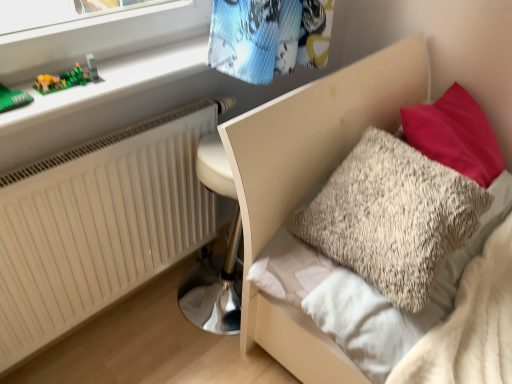
Describe the element at coordinates (112, 83) in the screenshot. I see `green plastic blocks at upper left` at that location.

Image resolution: width=512 pixels, height=384 pixels. Find the location of `green plastic blocks at upper left`. green plastic blocks at upper left is located at coordinates (112, 83).

What's the angular difference between green plastic blocks at upper left and fluffy beige pillow at upper right's facing directions?

The angular difference between green plastic blocks at upper left and fluffy beige pillow at upper right is 1.05 degrees.

Which of these two, green plastic blocks at upper left or fluffy beige pillow at upper right, is wider?

fluffy beige pillow at upper right is wider.

Is green plastic blocks at upper left oriented towards fluffy beige pillow at upper right?

No, green plastic blocks at upper left is not turned towards fluffy beige pillow at upper right.

Looking at this image, from the image's perspective, would you say green plastic blocks at upper left is positioned over fluffy beige pillow at upper right?

Indeed, from the image's perspective, green plastic blocks at upper left is shown above fluffy beige pillow at upper right.

Is white matte radiator at lower left directly adjacent to fluffy beige pillow at upper right?

No, white matte radiator at lower left is not making contact with fluffy beige pillow at upper right.

Is white matte radiator at lower left oriented towards fluffy beige pillow at upper right?

Yes, white matte radiator at lower left faces towards fluffy beige pillow at upper right.

Between white matte radiator at lower left and fluffy beige pillow at upper right, which one has less height?

With less height is white matte radiator at lower left.

The width and height of the screenshot is (512, 384). I want to click on bed above the white matte radiator at lower left (from the image's perspective), so click(x=315, y=132).

From the picture: From the image's perspective, is white matte radiator at lower left over green plastic toy at upper left?

No, from the image's perspective, white matte radiator at lower left is not on top of green plastic toy at upper left.

Which object is wider, white matte radiator at lower left or green plastic toy at upper left?

green plastic toy at upper left is wider.

Which is closer, (25,334) or (69,86)?

The point (69,86) is in front.

From a real-world perspective, is fluffy beige pillow at upper right located higher than white matte radiator at lower left?

Indeed, from a real-world perspective, fluffy beige pillow at upper right stands above white matte radiator at lower left.

From their relative heights in the image, would you say fluffy beige pillow at upper right is taller or shorter than white matte radiator at lower left?

In the image, fluffy beige pillow at upper right appears to be shorter than white matte radiator at lower left.

Is fluffy beige pillow at upper right looking in the opposite direction of white matte radiator at lower left?

No.

Is white matte radiator at lower left surrounded by fluffy beige pillow at upper right?

No, white matte radiator at lower left is not a part of fluffy beige pillow at upper right.

From the image's perspective, is fluffy beige pillow at upper right located beneath green plastic toy at upper left?

Correct, fluffy beige pillow at upper right appears lower than green plastic toy at upper left in the image.

Where is `toy positioned vertically above the fluffy beige pillow at upper right (from a real-world perspective)`? The width and height of the screenshot is (512, 384). toy positioned vertically above the fluffy beige pillow at upper right (from a real-world perspective) is located at coordinates (68, 78).

Based on the photo, how much distance is there between fluffy beige pillow at upper right and green plastic toy at upper left?

They are 71.98 centimeters apart.

Which object is closer to the camera, fluffy beige pillow at upper right or green plastic toy at upper left?

fluffy beige pillow at upper right is in front.

Which is closer, (126,178) or (160,55)?

Point (126,178) is positioned closer to the camera compared to point (160,55).

Is white matte radiator at lower left smaller than green plastic blocks at upper left?

No, white matte radiator at lower left is not smaller than green plastic blocks at upper left.

Is white matte radiator at lower left aimed at green plastic blocks at upper left?

No.

Visually, is green plastic toy at upper left positioned to the left or to the right of fluffy beige pillow at upper right?

In the image, green plastic toy at upper left appears on the left side of fluffy beige pillow at upper right.

Does green plastic toy at upper left turn towards fluffy beige pillow at upper right?

No, green plastic toy at upper left is not facing towards fluffy beige pillow at upper right.

Is point (70, 80) closer or farther from the camera than point (326, 127)?

Clearly, point (70, 80) is closer to the camera than point (326, 127).

From the picture: How much distance is there between green plastic toy at upper left and fluffy beige pillow at upper right?

green plastic toy at upper left and fluffy beige pillow at upper right are 28.34 inches apart.

Where is `window sill that is behind the fluffy beige pillow at upper right`? This screenshot has height=384, width=512. window sill that is behind the fluffy beige pillow at upper right is located at coordinates (112, 83).

The height and width of the screenshot is (384, 512). I want to click on bed that appears in front of the white matte radiator at lower left, so click(315, 132).

Looking at the image, which one is located closer to fluffy beige pillow at upper right, fluffy beige pillow at upper right or white matte radiator at lower left?

The object closer to fluffy beige pillow at upper right is fluffy beige pillow at upper right.

Which object lies further to the anchor point fluffy beige pillow at upper right, green plastic blocks at upper left or fluffy beige pillow at upper right?

green plastic blocks at upper left is further to fluffy beige pillow at upper right.

Which object lies nearer to the anchor point fluffy beige pillow at upper right, fluffy beige pillow at upper right or green plastic blocks at upper left?

Among the two, fluffy beige pillow at upper right is located nearer to fluffy beige pillow at upper right.

Considering their positions, is fluffy beige pillow at upper right positioned closer to fluffy beige pillow at upper right than green plastic toy at upper left?

The object closer to fluffy beige pillow at upper right is fluffy beige pillow at upper right.

Considering their positions, is white matte radiator at lower left positioned further to green plastic toy at upper left than fluffy beige pillow at upper right?

fluffy beige pillow at upper right.

Which object lies nearer to the anchor point green plastic blocks at upper left, fluffy beige pillow at upper right or white matte radiator at lower left?

white matte radiator at lower left is closer to green plastic blocks at upper left.

From the picture: Considering their positions, is fluffy beige pillow at upper right positioned closer to fluffy beige pillow at upper right than green plastic blocks at upper left?

fluffy beige pillow at upper right is closer to fluffy beige pillow at upper right.

Which object lies nearer to the anchor point white matte radiator at lower left, fluffy beige pillow at upper right or green plastic toy at upper left?

Based on the image, green plastic toy at upper left appears to be nearer to white matte radiator at lower left.

You are a GUI agent. You are given a task and a screenshot of the screen. Output one action in this format:
    pyautogui.click(x=<x>, y=<y>)
    Task: Click on the toy that lies between green plastic blocks at upper left and white matte radiator at lower left from top to bottom
    
    Given the screenshot: What is the action you would take?
    pyautogui.click(x=68, y=78)

Locate an element on the screen. window sill situated between white matte radiator at lower left and fluffy beige pillow at upper right from left to right is located at coordinates (112, 83).

The height and width of the screenshot is (384, 512). Find the location of `pillow located between green plastic toy at upper left and fluffy beige pillow at upper right in the left-right direction`. pillow located between green plastic toy at upper left and fluffy beige pillow at upper right in the left-right direction is located at coordinates (392, 217).

You are a GUI agent. You are given a task and a screenshot of the screen. Output one action in this format:
    pyautogui.click(x=<x>, y=<y>)
    Task: Click on the radiator situated between green plastic toy at upper left and fluffy beige pillow at upper right from left to right
    The height and width of the screenshot is (384, 512).
    Given the screenshot: What is the action you would take?
    pyautogui.click(x=98, y=225)